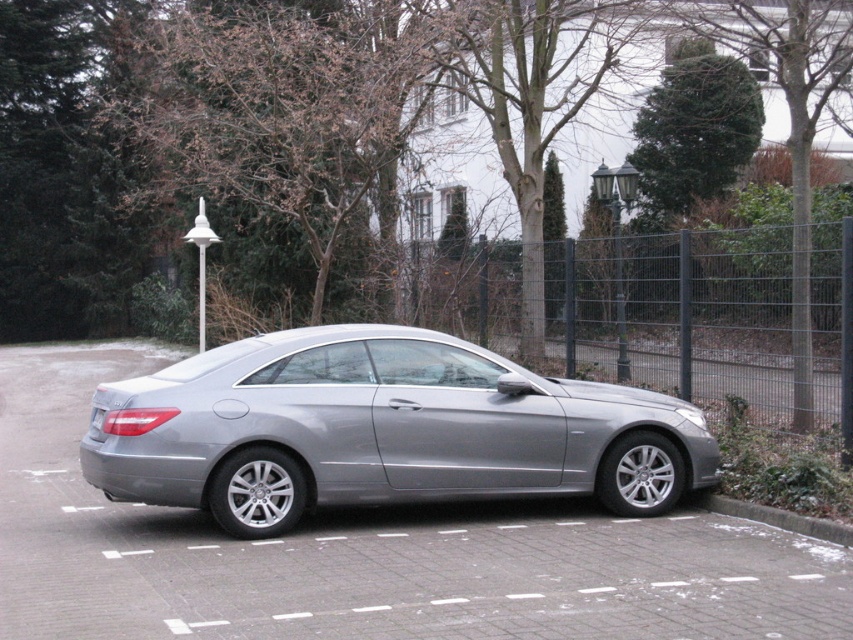
Can you confirm if satin silver car at center is taller than gray metallic license plate at center?

Yes, satin silver car at center is taller than gray metallic license plate at center.

Does satin silver car at center appear over gray metallic license plate at center?

No.

Where is `satin silver car at center`? Image resolution: width=853 pixels, height=640 pixels. satin silver car at center is located at coordinates (381, 429).

Which is more to the left, metallic wire mesh fence at center or green textured bush at upper right?

metallic wire mesh fence at center is more to the left.

Can you confirm if metallic wire mesh fence at center is positioned below green textured bush at upper right?

Correct, metallic wire mesh fence at center is located below green textured bush at upper right.

Is point (769, 243) more distant than point (635, 125)?

No, (769, 243) is closer to viewer.

Image resolution: width=853 pixels, height=640 pixels. I want to click on metallic wire mesh fence at center, so click(670, 314).

Which is behind, point (775, 515) or point (100, 422)?

The point (775, 515) is behind.

You are a GUI agent. You are given a task and a screenshot of the screen. Output one action in this format:
    pyautogui.click(x=<x>, y=<y>)
    Task: Click on the gray concrete curb at lower right
    
    Given the screenshot: What is the action you would take?
    pyautogui.click(x=778, y=518)

The height and width of the screenshot is (640, 853). Find the location of `gray concrete curb at lower right`. gray concrete curb at lower right is located at coordinates (778, 518).